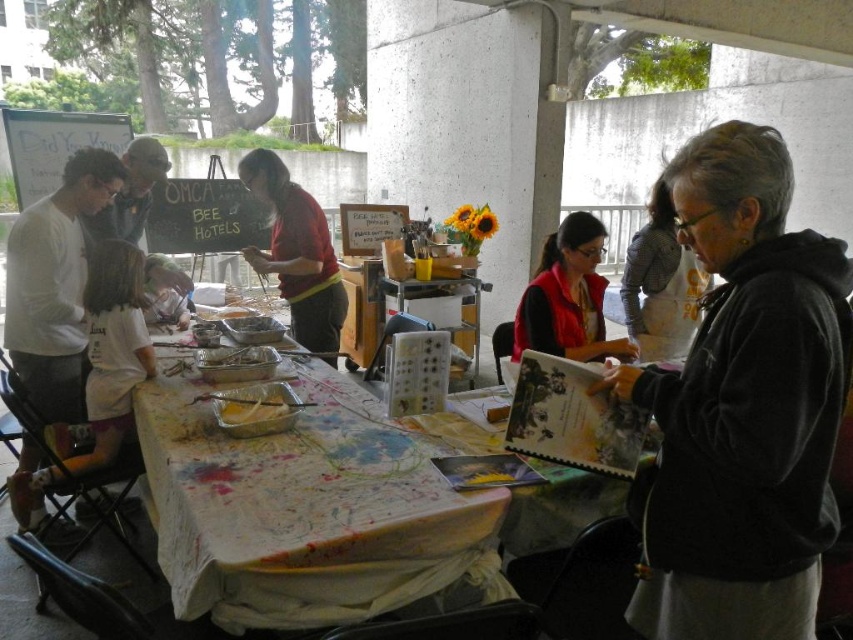
Question: Estimate the real-world distances between objects in this image. Which object is farther from the white paper table at center?

Choices:
 (A) black hoodie at center
 (B) white cotton shirt at left
 (C) matte red vest at center

Answer: (C)

Question: Which point is closer to the camera?

Choices:
 (A) (152, 440)
 (B) (822, 390)

Answer: (B)

Question: Does white paper table at center have a greater width compared to matte black hoodie at right?

Choices:
 (A) yes
 (B) no

Answer: (A)

Question: Does black hoodie at center appear under matte black hoodie at right?

Choices:
 (A) no
 (B) yes

Answer: (B)

Question: Is white cotton shirt at left thinner than red fabric shirt at center?

Choices:
 (A) yes
 (B) no

Answer: (B)

Question: Which object appears closest to the camera in this image?

Choices:
 (A) matte black hoodie at right
 (B) matte red vest at center

Answer: (B)